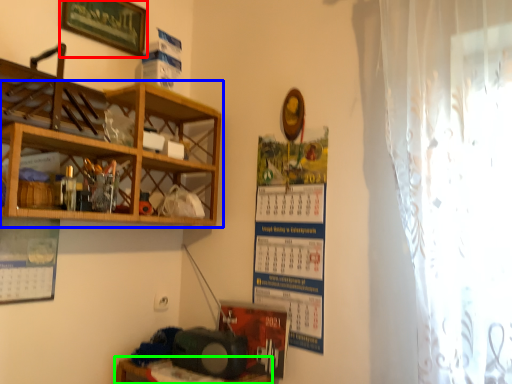
Question: Which is farther away from picture frame (highlighted by a red box)? shelf (highlighted by a blue box) or table (highlighted by a green box)?

Choices:
 (A) shelf
 (B) table

Answer: (B)